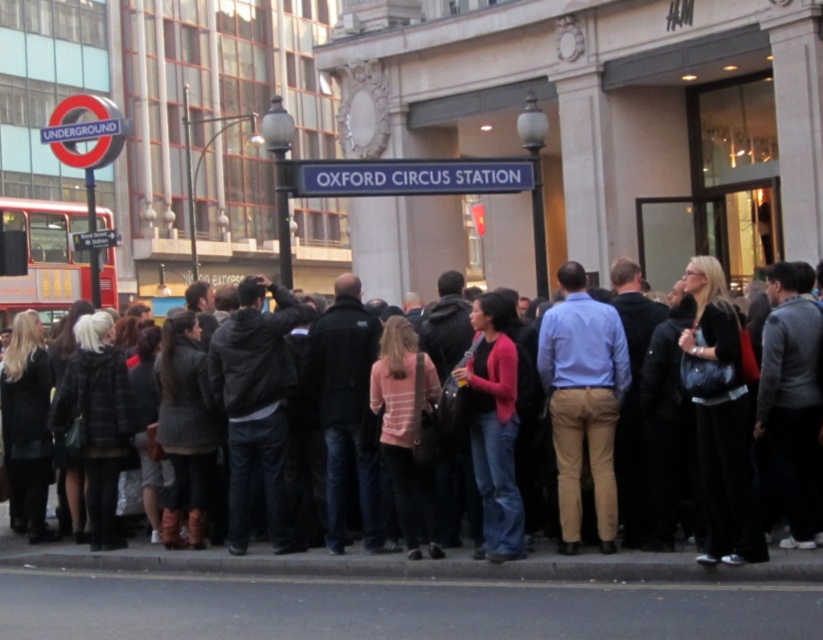
You are a delivery person carrying a package that is 5 feet long. You need to pass through the crowd at Oxford Circus Station between the dark gray jacket at center and the matte pink sweater at center. Is there enough space for the package to fit through without bending it?

The distance between the dark gray jacket at center and the matte pink sweater at center is 4.62 feet. Since the package is 5 feet long, it would not fit through the space between them without bending.

You are a photographer standing at Oxford Circus Station and want to take a photo of the dark gray jacket at center. Where should you position your camera to capture it in the frame?

The dark gray jacket at center is located at the 2D coordinates point (323, 561), so you should position your camera to aim directly at that point to capture it in the frame.